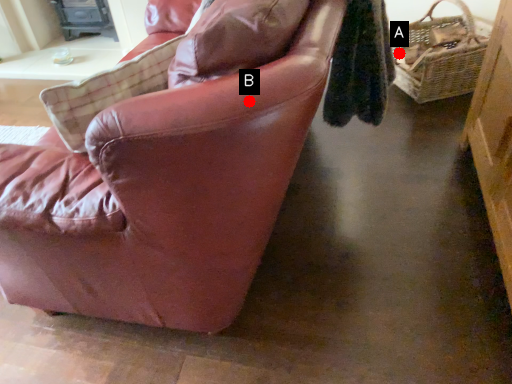
Question: Two points are circled on the image, labeled by A and B beside each circle. Which point appears farthest from the camera in this image?

Choices:
 (A) A is further
 (B) B is further

Answer: (A)